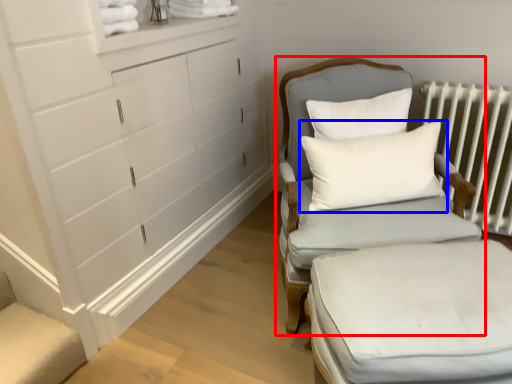
Question: Which point is further to the camera, chair (highlighted by a red box) or pillow (highlighted by a blue box)?

Choices:
 (A) chair
 (B) pillow

Answer: (B)